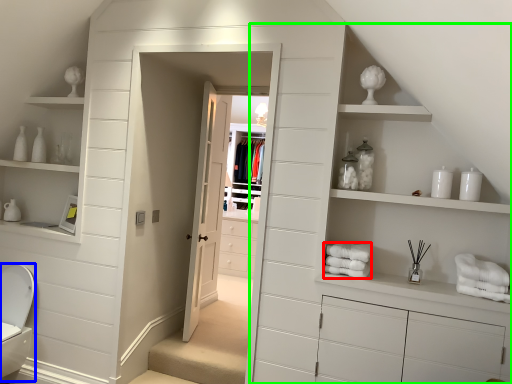
Question: Which is farther away from bath towel (highlighted by a red box)? toilet bowl (highlighted by a blue box) or dresser (highlighted by a green box)?

Choices:
 (A) toilet bowl
 (B) dresser

Answer: (A)